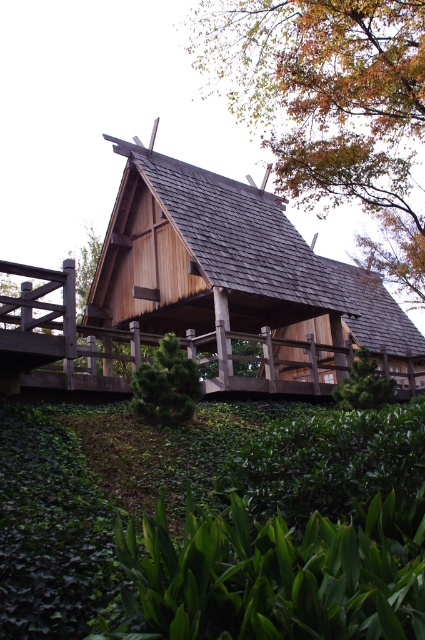
You are standing in front of the traditional wooden structure and want to determine the relative positions of two points marked on the structure. Which point is closer to you, point at coordinates [186,292] or point at coordinates [357,161]?

Point at coordinates [186,292] is closer to you than point at coordinates [357,161] because it is further to the viewer according to the description.

You are standing at the base of the hill where the wooden cabin at center and the brown wooden roof at upper center are located. Which object would you encounter first as you walk towards the structure?

The wooden cabin at center is closer to the viewer than the brown wooden roof at upper center, so you would encounter the wooden cabin at center first as you approach the structure.